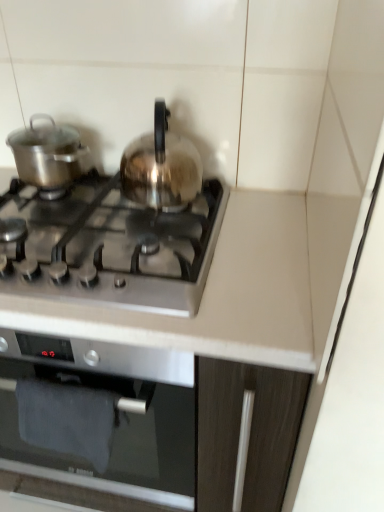
How much space does satin silver kettle at center, the second kitchen appliance when ordered from left to right, occupy vertically?

satin silver kettle at center, the second kitchen appliance when ordered from left to right, is 21.23 centimeters tall.

The width and height of the screenshot is (384, 512). Find the location of `satin silver gas stove at center`. satin silver gas stove at center is located at coordinates (113, 248).

Where is `satin silver kettle at center, the second kitchen appliance when ordered from left to right`? The image size is (384, 512). satin silver kettle at center, the second kitchen appliance when ordered from left to right is located at coordinates (161, 167).

Is satin silver gas stove at center positioned with its back to satin silver kettle at center, marked as the first kitchen appliance in a right-to-left arrangement?

satin silver gas stove at center is not turned away from satin silver kettle at center, marked as the first kitchen appliance in a right-to-left arrangement.

Can you tell me how much satin silver gas stove at center and satin silver kettle at center, marked as the first kitchen appliance in a right-to-left arrangement, differ in facing direction?

The facing directions of satin silver gas stove at center and satin silver kettle at center, marked as the first kitchen appliance in a right-to-left arrangement, are 2.82 degrees apart.

Looking at this image, from the image's perspective, relative to satin silver kettle at center, marked as the first kitchen appliance in a right-to-left arrangement, is satin silver gas stove at center above or below?

satin silver gas stove at center is below satin silver kettle at center, marked as the first kitchen appliance in a right-to-left arrangement.

From a real-world perspective, relative to satin silver kettle at center, the second kitchen appliance when ordered from left to right, is satin silver gas stove at center vertically above or below?

Clearly, from a real-world perspective, satin silver gas stove at center is below satin silver kettle at center, the second kitchen appliance when ordered from left to right.

Which of these two, satin silver kettle at center, the second kitchen appliance when ordered from left to right, or satin silver gas stove at center, stands taller?

satin silver kettle at center, the second kitchen appliance when ordered from left to right.

In the image, is satin silver kettle at center, marked as the first kitchen appliance in a right-to-left arrangement, positioned in front of or behind satin silver gas stove at center?

satin silver kettle at center, marked as the first kitchen appliance in a right-to-left arrangement, is behind satin silver gas stove at center.

Considering the relative positions of satin silver kettle at center, marked as the first kitchen appliance in a right-to-left arrangement, and satin silver gas stove at center in the image provided, is satin silver kettle at center, marked as the first kitchen appliance in a right-to-left arrangement, to the left of satin silver gas stove at center from the viewer's perspective?

Incorrect, satin silver kettle at center, marked as the first kitchen appliance in a right-to-left arrangement, is not on the left side of satin silver gas stove at center.

Based on the photo, from a real-world perspective, is satin silver kettle at center, the second kitchen appliance when ordered from left to right, below satin silver gas stove at center?

Actually, satin silver kettle at center, the second kitchen appliance when ordered from left to right, is physically above satin silver gas stove at center in the real world.

Is satin silver gas stove at center wider than shiny silver pot at left, acting as the second kitchen appliance starting from the right?

Yes, satin silver gas stove at center is wider than shiny silver pot at left, acting as the second kitchen appliance starting from the right.

What are the coordinates of `gas stove in front of the shiny silver pot at left, the first kitchen appliance when ordered from left to right` in the screenshot? It's located at (113, 248).

Can you confirm if satin silver gas stove at center is taller than shiny silver pot at left, the first kitchen appliance when ordered from left to right?

Incorrect, the height of satin silver gas stove at center is not larger of that of shiny silver pot at left, the first kitchen appliance when ordered from left to right.

From the image's perspective, is satin silver gas stove at center on top of shiny silver pot at left, acting as the second kitchen appliance starting from the right?

Incorrect, from the image's perspective, satin silver gas stove at center is lower than shiny silver pot at left, acting as the second kitchen appliance starting from the right.

From the image's perspective, is shiny silver pot at left, acting as the second kitchen appliance starting from the right, over satin silver kettle at center, the second kitchen appliance when ordered from left to right?

Yes, from the image's perspective, shiny silver pot at left, acting as the second kitchen appliance starting from the right, is on top of satin silver kettle at center, the second kitchen appliance when ordered from left to right.

Between shiny silver pot at left, acting as the second kitchen appliance starting from the right, and satin silver kettle at center, the second kitchen appliance when ordered from left to right, which one has smaller size?

shiny silver pot at left, acting as the second kitchen appliance starting from the right, is smaller.

Considering the relative sizes of shiny silver pot at left, acting as the second kitchen appliance starting from the right, and satin silver kettle at center, marked as the first kitchen appliance in a right-to-left arrangement, in the image provided, is shiny silver pot at left, acting as the second kitchen appliance starting from the right, thinner than satin silver kettle at center, marked as the first kitchen appliance in a right-to-left arrangement,?

Correct, the width of shiny silver pot at left, acting as the second kitchen appliance starting from the right, is less than that of satin silver kettle at center, marked as the first kitchen appliance in a right-to-left arrangement.

Is shiny silver pot at left, the first kitchen appliance when ordered from left to right, touching satin silver kettle at center, the second kitchen appliance when ordered from left to right?

shiny silver pot at left, the first kitchen appliance when ordered from left to right, is not next to satin silver kettle at center, the second kitchen appliance when ordered from left to right, and they're not touching.

From the image's perspective, does shiny silver pot at left, acting as the second kitchen appliance starting from the right, appear lower than satin silver gas stove at center?

No, from the image's perspective, shiny silver pot at left, acting as the second kitchen appliance starting from the right, is not below satin silver gas stove at center.

The height and width of the screenshot is (512, 384). Identify the location of gas stove in front of the shiny silver pot at left, acting as the second kitchen appliance starting from the right. pyautogui.click(x=113, y=248).

Consider the image. Who is taller, shiny silver pot at left, the first kitchen appliance when ordered from left to right, or satin silver gas stove at center?

With more height is shiny silver pot at left, the first kitchen appliance when ordered from left to right.

What's the angular difference between satin silver kettle at center, the second kitchen appliance when ordered from left to right, and shiny silver pot at left, acting as the second kitchen appliance starting from the right,'s facing directions?

The angular difference between satin silver kettle at center, the second kitchen appliance when ordered from left to right, and shiny silver pot at left, acting as the second kitchen appliance starting from the right, is 2.72 degrees.

Is satin silver kettle at center, the second kitchen appliance when ordered from left to right, touching shiny silver pot at left, acting as the second kitchen appliance starting from the right?

No, satin silver kettle at center, the second kitchen appliance when ordered from left to right, is not with shiny silver pot at left, acting as the second kitchen appliance starting from the right.

Does satin silver kettle at center, marked as the first kitchen appliance in a right-to-left arrangement, have a larger size compared to shiny silver pot at left, acting as the second kitchen appliance starting from the right?

Indeed, satin silver kettle at center, marked as the first kitchen appliance in a right-to-left arrangement, has a larger size compared to shiny silver pot at left, acting as the second kitchen appliance starting from the right.

Considering the points (150, 206) and (60, 169), which point is in front, point (150, 206) or point (60, 169)?

Positioned in front is point (150, 206).

The image size is (384, 512). I want to click on gas stove located in front of the satin silver kettle at center, marked as the first kitchen appliance in a right-to-left arrangement, so click(113, 248).

The height and width of the screenshot is (512, 384). Identify the location of kitchen appliance on the right of satin silver gas stove at center. (161, 167).

Based on the photo, from the image, which object appears to be nearer to satin silver kettle at center, the second kitchen appliance when ordered from left to right, shiny silver pot at left, the first kitchen appliance when ordered from left to right, or satin silver gas stove at center?

satin silver gas stove at center.

Estimate the real-world distances between objects in this image. Which object is closer to shiny silver pot at left, acting as the second kitchen appliance starting from the right, satin silver gas stove at center or satin silver kettle at center, marked as the first kitchen appliance in a right-to-left arrangement?

satin silver kettle at center, marked as the first kitchen appliance in a right-to-left arrangement, is closer to shiny silver pot at left, acting as the second kitchen appliance starting from the right.

Considering their positions, is satin silver kettle at center, the second kitchen appliance when ordered from left to right, positioned closer to satin silver gas stove at center than shiny silver pot at left, acting as the second kitchen appliance starting from the right?

satin silver kettle at center, the second kitchen appliance when ordered from left to right, is positioned closer to the anchor satin silver gas stove at center.

Considering their positions, is satin silver kettle at center, the second kitchen appliance when ordered from left to right, positioned closer to shiny silver pot at left, the first kitchen appliance when ordered from left to right, than satin silver gas stove at center?

satin silver kettle at center, the second kitchen appliance when ordered from left to right, is closer to shiny silver pot at left, the first kitchen appliance when ordered from left to right.

From the picture: Estimate the real-world distances between objects in this image. Which object is closer to satin silver kettle at center, marked as the first kitchen appliance in a right-to-left arrangement, satin silver gas stove at center or shiny silver pot at left, acting as the second kitchen appliance starting from the right?

Based on the image, satin silver gas stove at center appears to be nearer to satin silver kettle at center, marked as the first kitchen appliance in a right-to-left arrangement.

Looking at the image, which one is located further to satin silver gas stove at center, shiny silver pot at left, acting as the second kitchen appliance starting from the right, or satin silver kettle at center, the second kitchen appliance when ordered from left to right?

shiny silver pot at left, acting as the second kitchen appliance starting from the right, is positioned further to the anchor satin silver gas stove at center.

The width and height of the screenshot is (384, 512). I want to click on gas stove between shiny silver pot at left, the first kitchen appliance when ordered from left to right, and satin silver kettle at center, marked as the first kitchen appliance in a right-to-left arrangement, from left to right, so click(113, 248).